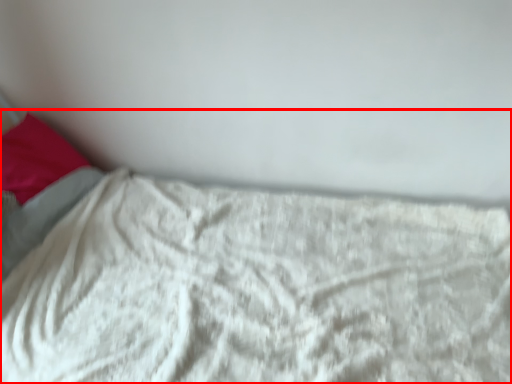
Question: In this image, where is bed (annotated by the red box) located relative to pillow?

Choices:
 (A) left
 (B) right

Answer: (B)